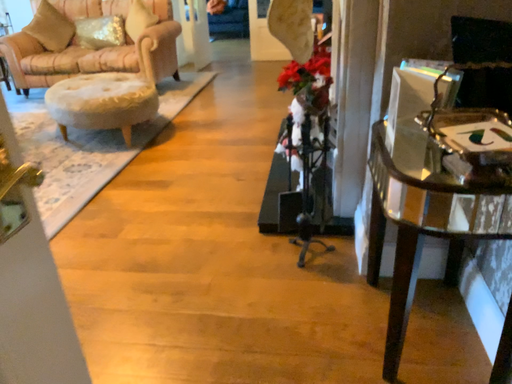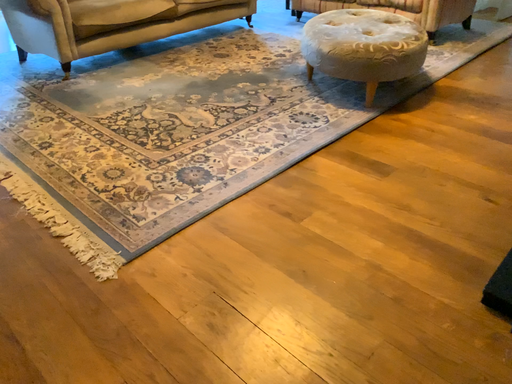
Question: How did the camera likely rotate when shooting the video?

Choices:
 (A) rotated left
 (B) rotated right

Answer: (A)